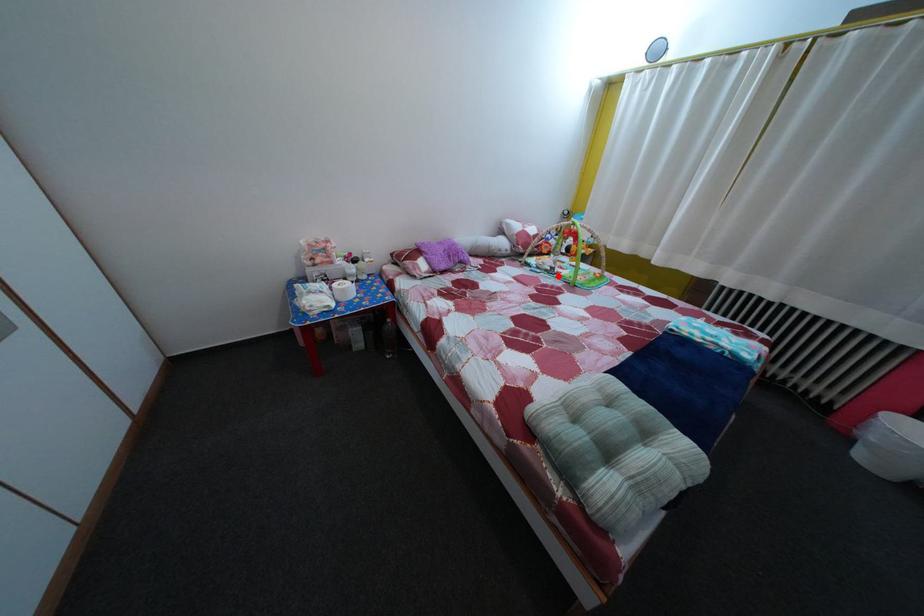
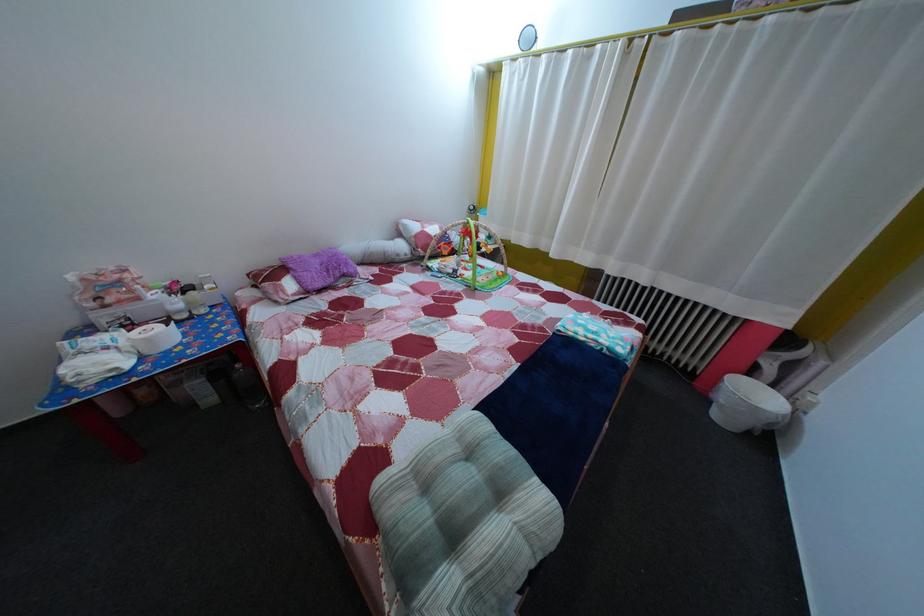
Find the pixel in the second image that matches the highlighted location in the first image.

(459, 278)